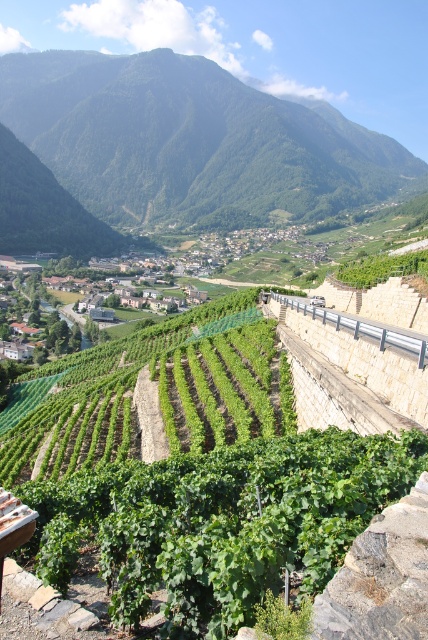
In the scene shown: Does green leafy hillside at upper center appear on the right side of green leafy vineyard at center?

In fact, green leafy hillside at upper center is to the left of green leafy vineyard at center.

Is green leafy hillside at upper center smaller than green leafy vineyard at center?

No.

This screenshot has height=640, width=428. Find the location of `green leafy hillside at upper center`. green leafy hillside at upper center is located at coordinates pos(190,140).